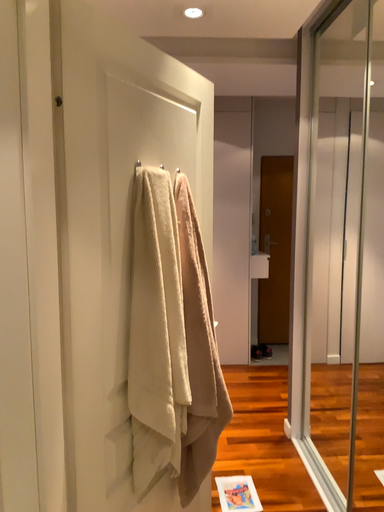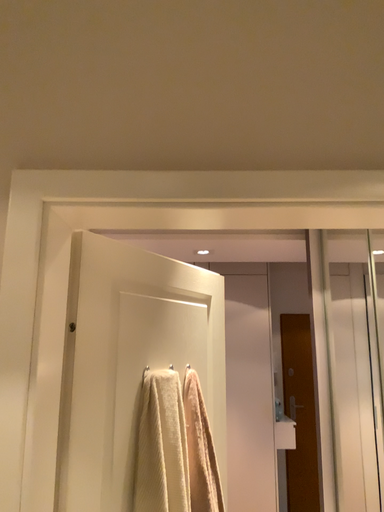
Question: Which way did the camera rotate in the video?

Choices:
 (A) rotated upward
 (B) rotated downward

Answer: (A)